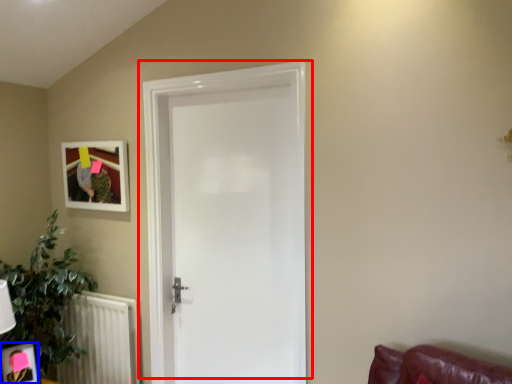
Question: Which object appears farthest to the camera in this image, door (highlighted by a red box) or picture frame (highlighted by a blue box)?

Choices:
 (A) door
 (B) picture frame

Answer: (B)